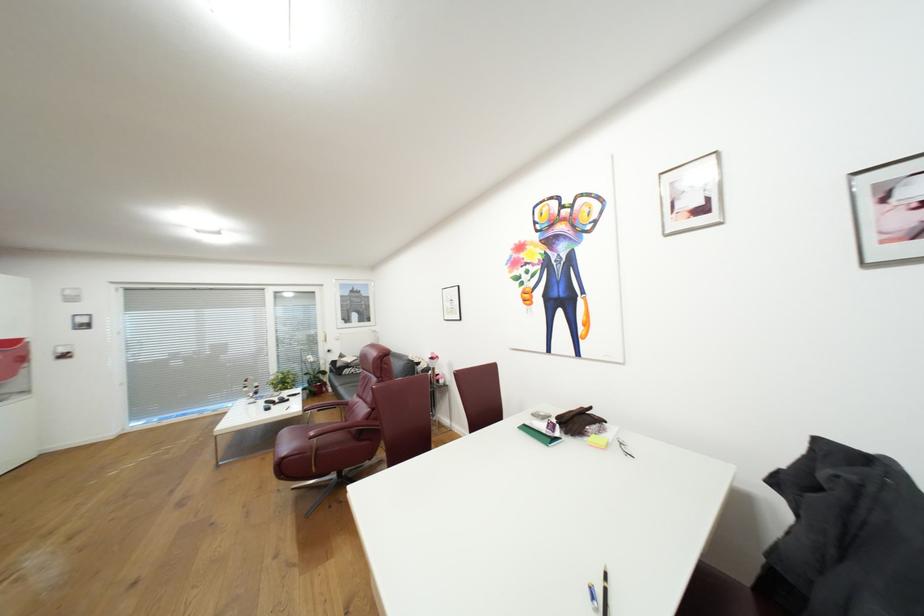
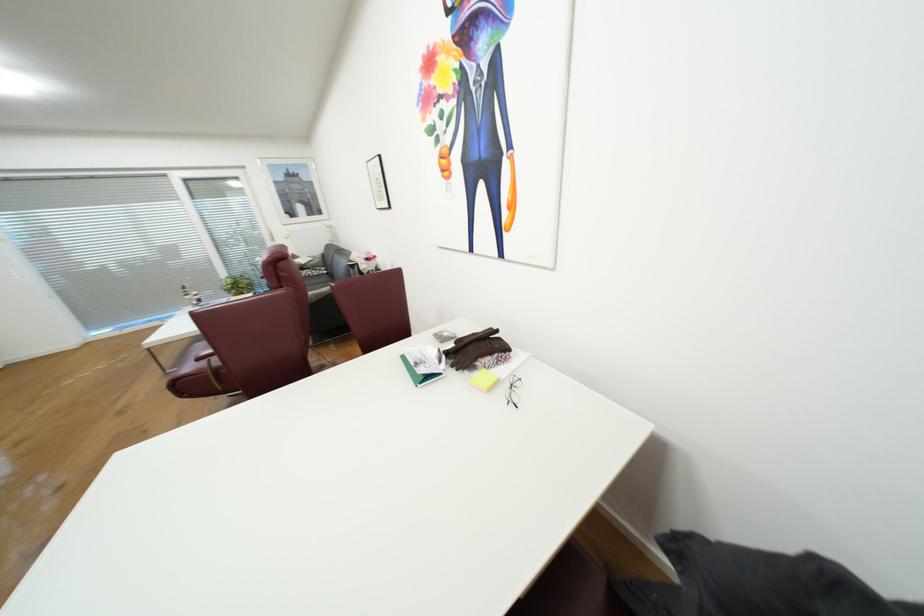
Where in the second image is the point corresponding to (602,438) from the first image?

(492, 373)